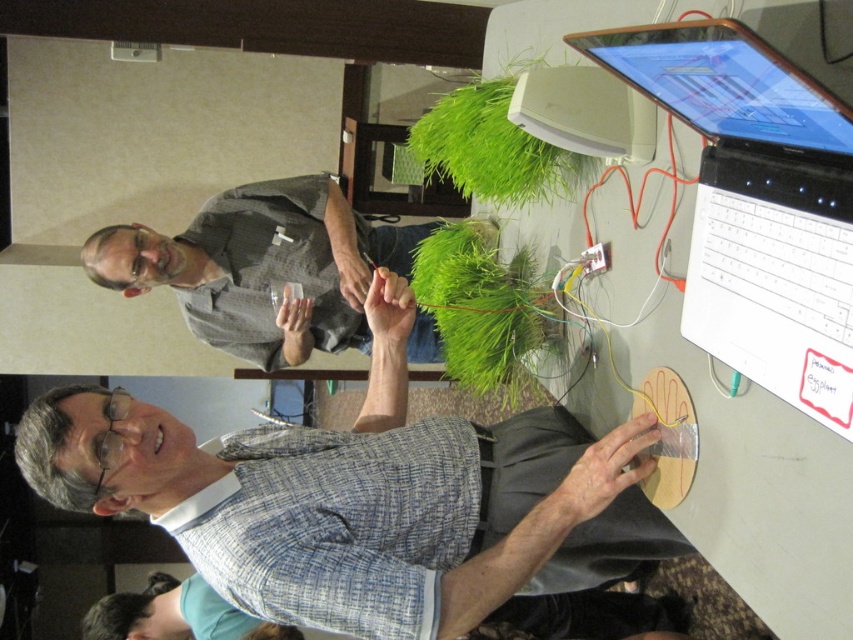
Question: Considering the real-world distances, which object is farthest from the black plastic laptop at upper right?

Choices:
 (A) gray fabric shirt at upper center
 (B) matte black laptop at upper right
 (C) blue plaid shirt at center

Answer: (A)

Question: Among these objects, which one is farthest from the camera?

Choices:
 (A) gray fabric shirt at upper center
 (B) matte black laptop at upper right
 (C) blue plaid shirt at lower center
 (D) white plastic computer at upper center

Answer: (C)

Question: Which object appears farthest from the camera in this image?

Choices:
 (A) matte black laptop at upper right
 (B) white plastic computer at upper center
 (C) blue plaid shirt at center

Answer: (B)

Question: Is matte black laptop at upper right to the left of white plastic computer at upper center from the viewer's perspective?

Choices:
 (A) yes
 (B) no

Answer: (B)

Question: Does black plastic laptop at upper right appear on the left side of matte black laptop at upper right?

Choices:
 (A) no
 (B) yes

Answer: (A)

Question: Does blue plaid shirt at lower center come in front of white plastic computer at upper center?

Choices:
 (A) yes
 (B) no

Answer: (B)